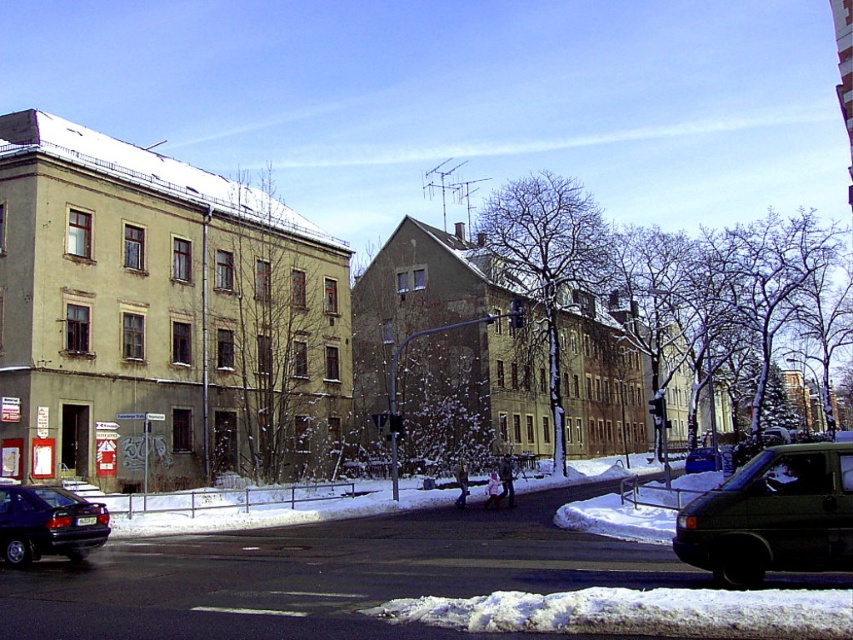
You are a delivery person trying to park your dark green matte van at lower right near the white fluffy snow at lower center. Based on the scene, can you fit the van in the available space next to the snow without overlapping?

The white fluffy snow at lower center has a larger width than the dark green matte van at lower right. Since the snow occupies a wider area, there should be enough space to park the van next to it without overlapping.

You are standing in the winter scene and want to reach the point marked as point (x=772, y=604). If your walking speed is 1.2 meters per second, how many seconds will it take you to reach that point?

The point (x=772, y=604) is 8.55 meters away from the viewer. At a walking speed of 1.2 meters per second, it would take approximately 7.125 seconds to reach the point.

Consider the image. You are a delivery driver who needs to park your truck, which is 2 meters wide, in this winter scene. There is a shiny dark blue sedan at lower left and a dark green matte car at center. Which parking spot between these two cars would allow your truck to fit without touching either vehicle?

The shiny dark blue sedan at lower left might be wider than the dark green matte car at center. Since the truck is 2 meters wide, you should choose the parking spot next to the dark green matte car at center as it is likely narrower, allowing more space for the truck.